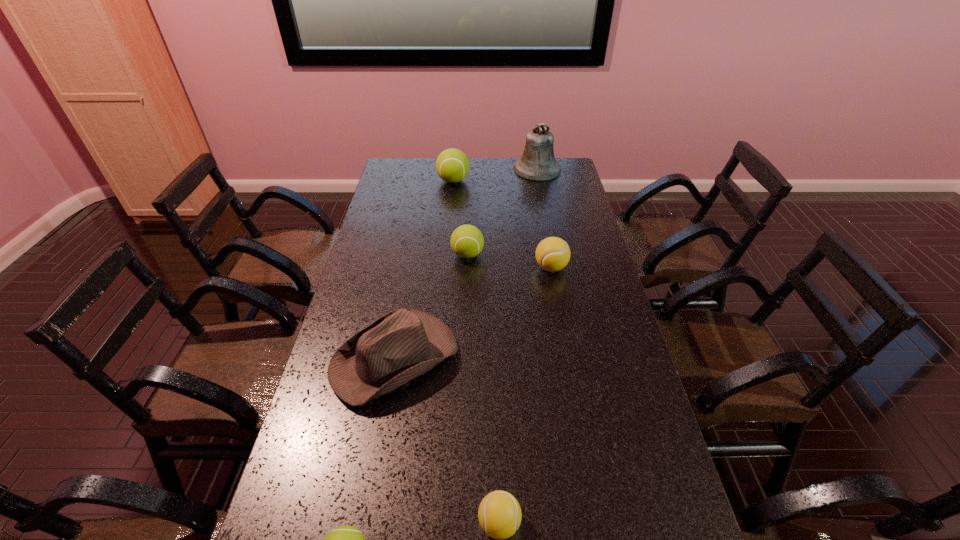
The height and width of the screenshot is (540, 960). Find the location of `the tallest object`. the tallest object is located at coordinates (537, 163).

Where is `the farthest tennis ball`? Image resolution: width=960 pixels, height=540 pixels. the farthest tennis ball is located at coordinates (452, 165).

Locate an element on the screen. The image size is (960, 540). the farthest green tennis ball is located at coordinates (452, 165).

What are the coordinates of `the fifth farthest object` in the screenshot? It's located at (403, 344).

This screenshot has width=960, height=540. I want to click on the farther yellow tennis ball, so click(552, 254).

Locate an element on the screen. the bigger yellow tennis ball is located at coordinates (552, 254).

At what (x,y) coordinates should I click in order to perform the action: click on the second biggest green tennis ball. Please return your answer as a coordinate pair (x, y). The width and height of the screenshot is (960, 540). Looking at the image, I should click on (467, 241).

The height and width of the screenshot is (540, 960). I want to click on blank area located 0.140m on the left of the bell, so click(x=484, y=169).

Where is `free point located on the left of the tallest tennis ball`? free point located on the left of the tallest tennis ball is located at coordinates 397,181.

This screenshot has width=960, height=540. I want to click on blank area located 0.320m on the right of the fifth farthest object, so click(x=570, y=359).